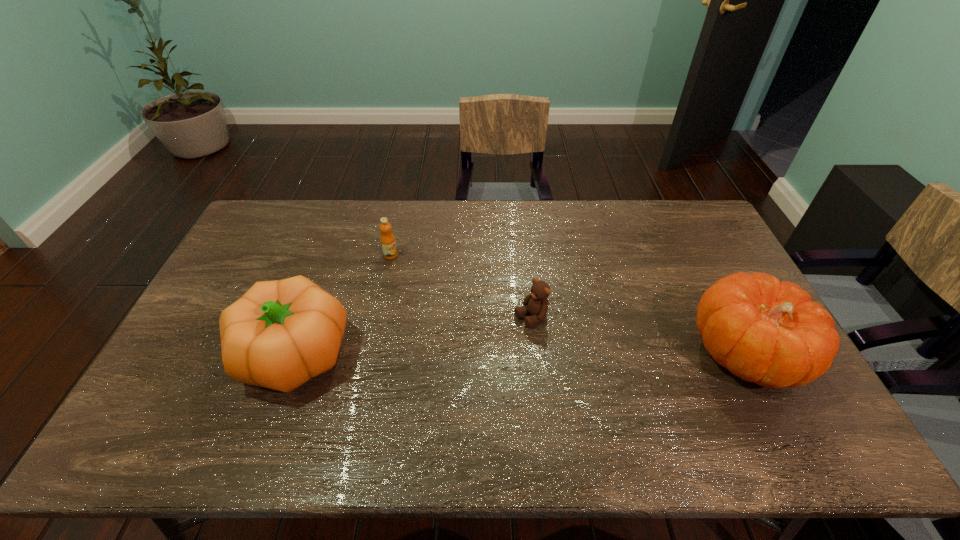
Locate an element on the screen. The height and width of the screenshot is (540, 960). blank space at the left edge of the desktop is located at coordinates (232, 287).

Where is `free space at the right edge`? This screenshot has width=960, height=540. free space at the right edge is located at coordinates (679, 253).

In order to click on vacant space that's between the rightmost object and the teddy bear in this screenshot , I will do `click(638, 335)`.

At what (x,y) coordinates should I click in order to perform the action: click on vacant space that's between the teddy bear and the right pumpkin. Please return your answer as a coordinate pair (x, y). The image size is (960, 540). Looking at the image, I should click on (638, 335).

Locate an element on the screen. Image resolution: width=960 pixels, height=540 pixels. free space between the left pumpkin and the right pumpkin is located at coordinates (519, 354).

Where is `vacant point located between the leftmost object and the shortest object`? The height and width of the screenshot is (540, 960). vacant point located between the leftmost object and the shortest object is located at coordinates (x=412, y=336).

Locate an element on the screen. This screenshot has height=540, width=960. blank region between the right pumpkin and the left pumpkin is located at coordinates (519, 354).

Find the location of a particular element. The height and width of the screenshot is (540, 960). free space between the farthest object and the right pumpkin is located at coordinates (568, 305).

Identify the location of unoccupied area between the shortest object and the right pumpkin. Image resolution: width=960 pixels, height=540 pixels. (x=638, y=335).

The image size is (960, 540). Find the location of `vacant space that's between the third tallest object and the rightmost object`. vacant space that's between the third tallest object and the rightmost object is located at coordinates (568, 305).